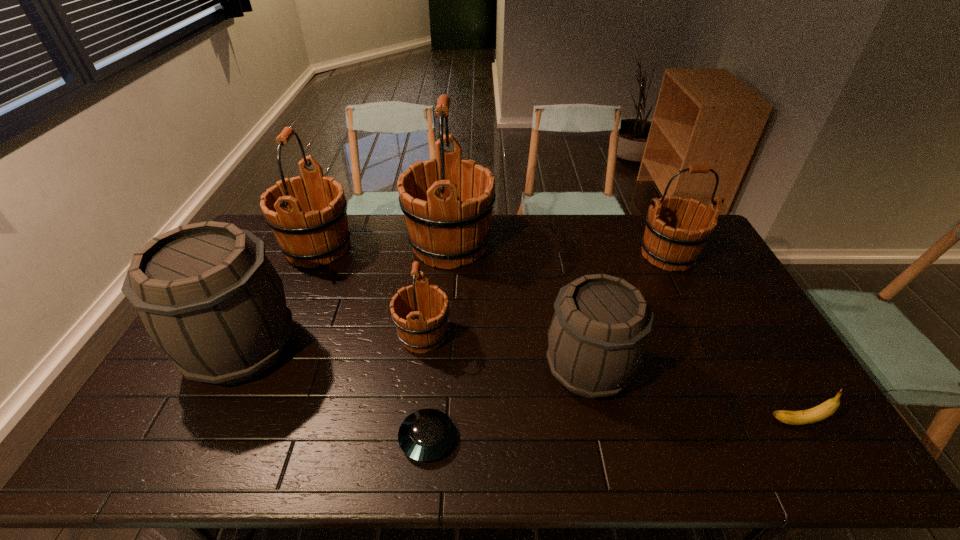
The width and height of the screenshot is (960, 540). What are the coordinates of `banana` in the screenshot? It's located at (818, 413).

What are the coordinates of `yellow banana` in the screenshot? It's located at (818, 413).

Identify the location of saucer. pyautogui.click(x=425, y=435).

I want to click on the shortest object, so click(425, 435).

Where is `free spot located on the front of the tallest object`? Image resolution: width=960 pixels, height=540 pixels. free spot located on the front of the tallest object is located at coordinates (444, 314).

Identify the location of vacant area situated 0.240m on the right of the second tallest wine bucket. (420, 248).

Find the location of a particular element. This screenshot has width=960, height=540. free space located 0.400m on the front of the rightmost wine bucket is located at coordinates (727, 372).

Find the location of `blank space located 0.310m on the right of the bigger brown wine bucket`. blank space located 0.310m on the right of the bigger brown wine bucket is located at coordinates (406, 348).

At what (x,y) coordinates should I click in order to perform the action: click on vacant region located 0.390m on the right of the nearest wood wine bucket. Please return your answer as a coordinate pair (x, y). Looking at the image, I should click on (582, 335).

Locate an element on the screen. vacant space located on the right of the smaller brown wine bucket is located at coordinates (722, 369).